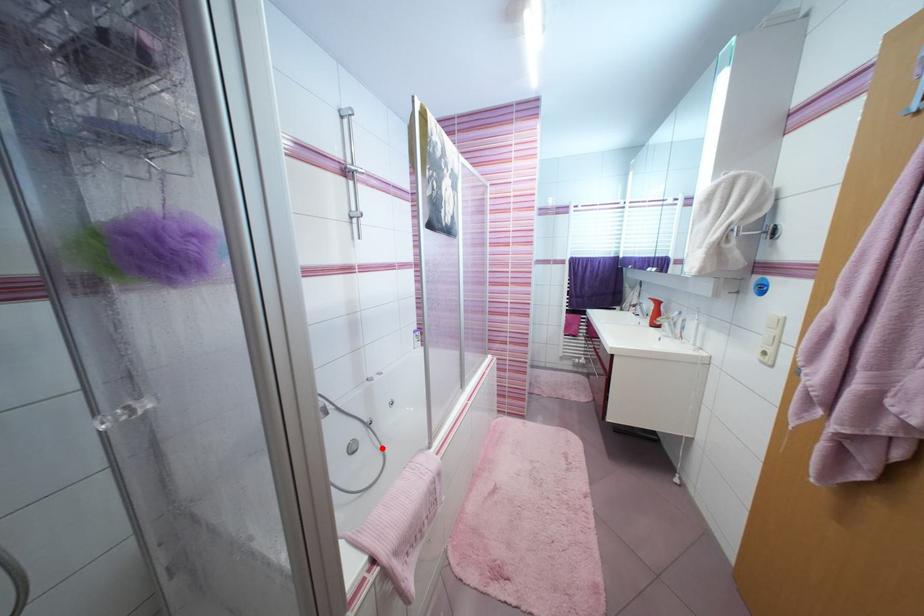
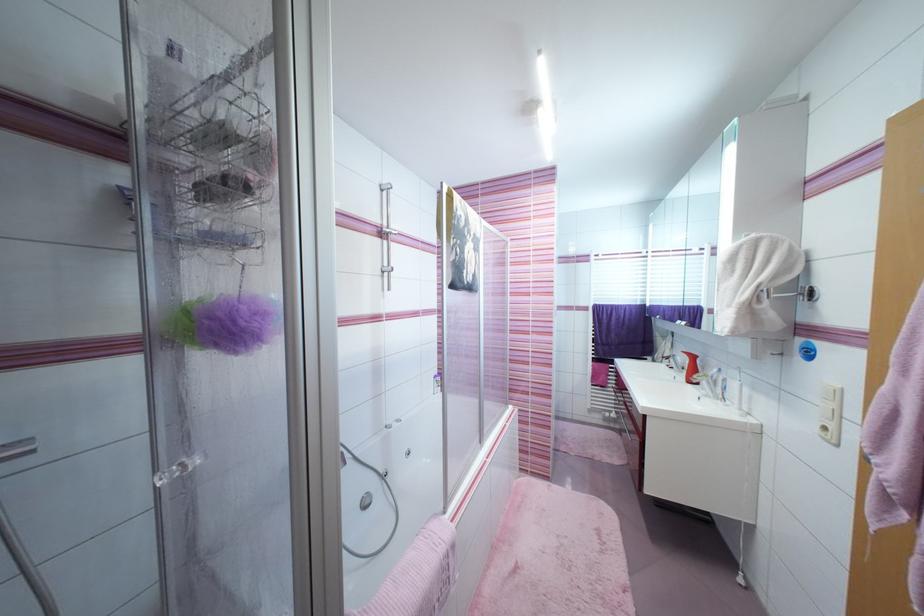
Question: I am providing you with two images of the same scene from different viewpoints. A red point is marked on the first image. Is the red point's position out of view in image 2?

Choices:
 (A) Yes
 (B) No

Answer: (B)